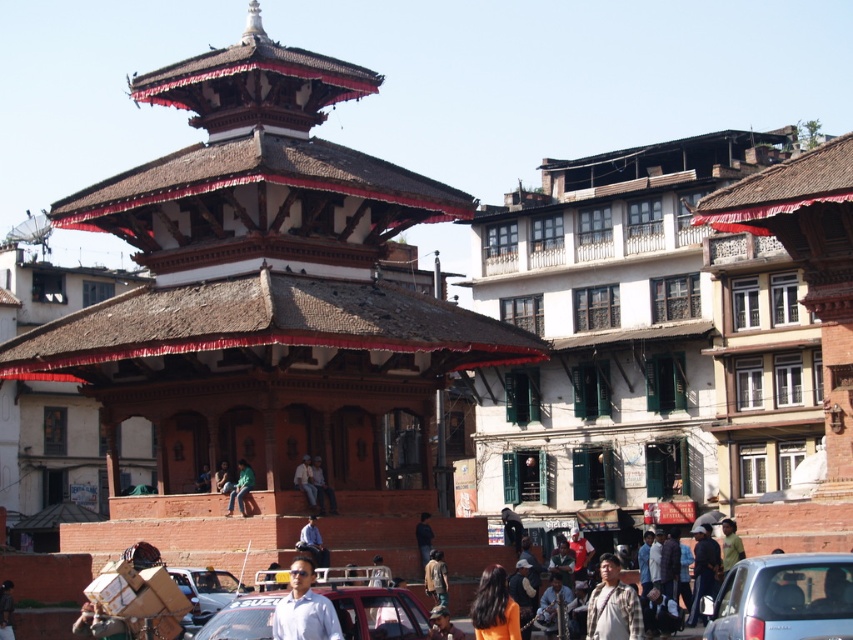
Question: Can you confirm if green fabric pants at center is positioned to the left of light brown leather jacket at center?

Choices:
 (A) yes
 (B) no

Answer: (A)

Question: Can you confirm if matte red car at center is positioned to the left of metallic silver taxi at center?

Choices:
 (A) no
 (B) yes

Answer: (A)

Question: Which object appears farthest from the camera in this image?

Choices:
 (A) white matte shirt at center
 (B) metallic silver taxi at center

Answer: (B)

Question: Which of the following is the farthest from the observer?

Choices:
 (A) (305, 627)
 (B) (373, 624)
 (C) (764, 609)

Answer: (B)

Question: Does white matte shirt at center have a larger size compared to metallic silver taxi at center?

Choices:
 (A) yes
 (B) no

Answer: (A)

Question: Which of the following is the farthest from the observer?

Choices:
 (A) (242, 483)
 (B) (329, 497)
 (C) (352, 589)

Answer: (B)